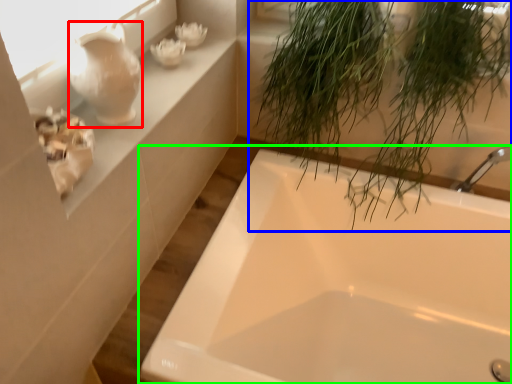
Question: Which object is positioned closest to glass vase (highlighted by a red box)? Select from houseplant (highlighted by a blue box) and bathtub (highlighted by a green box).

Choices:
 (A) houseplant
 (B) bathtub

Answer: (A)